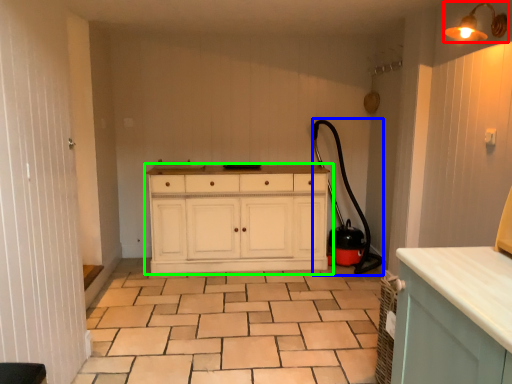
Question: Which object is the farthest from light fixture (highlighted by a red box)? Choose among these: garden hose (highlighted by a blue box) or chest of drawers (highlighted by a green box).

Choices:
 (A) garden hose
 (B) chest of drawers

Answer: (B)